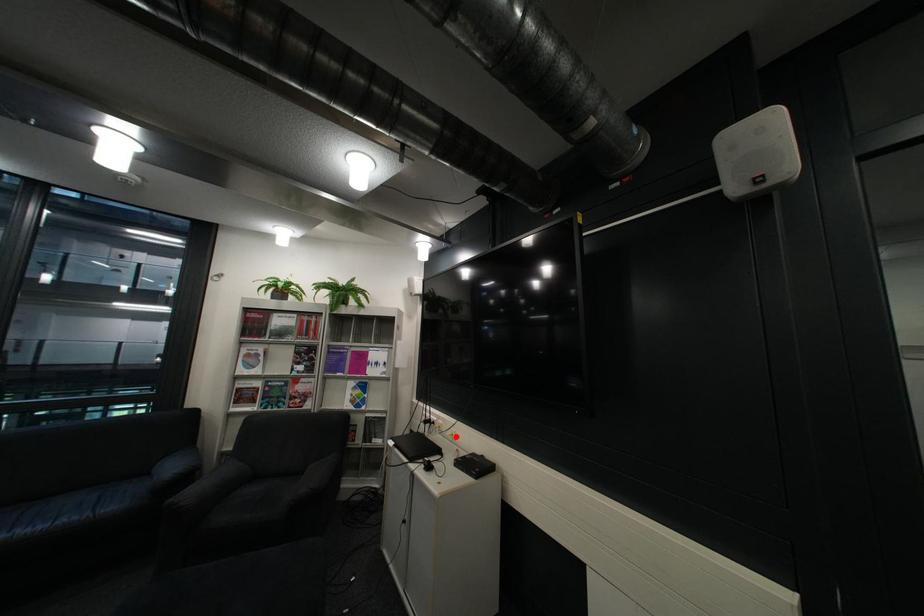
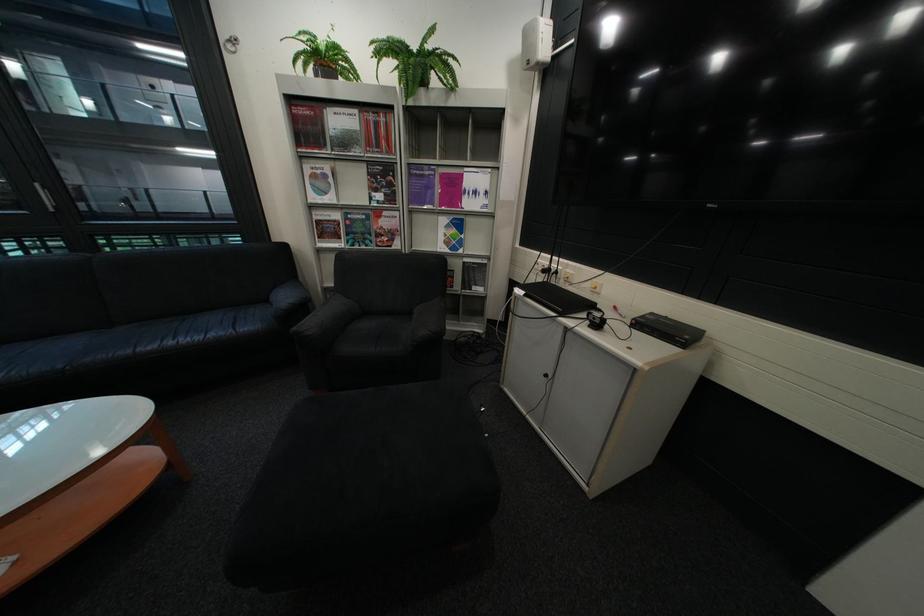
Question: I am providing you with two images of the same scene from different viewpoints. A red point is shown in image1. For the corresponding object point in image2, is it positioned nearer or farther from the camera?

Choices:
 (A) Nearer
 (B) Farther

Answer: (A)